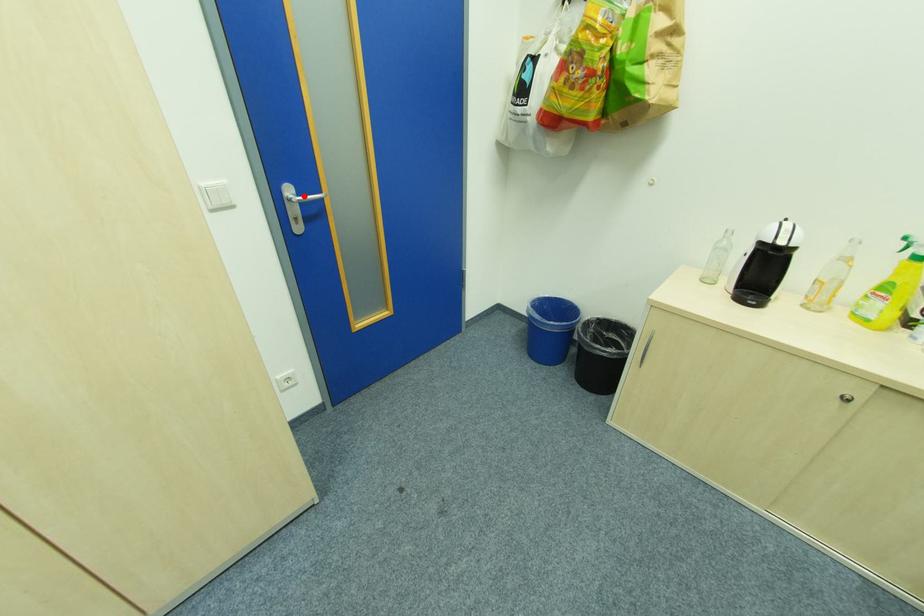
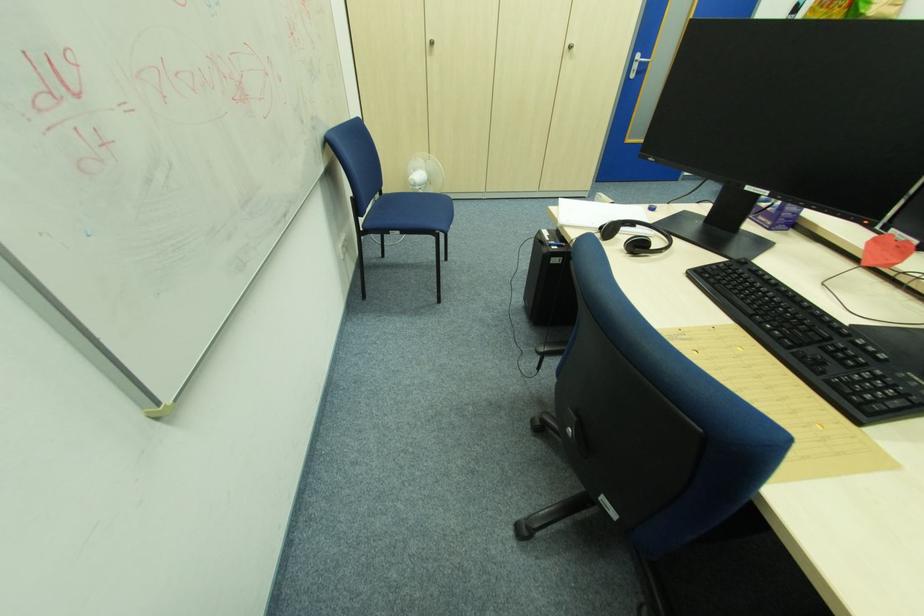
Locate, in the second image, the point that corresponds to the highlighted location in the first image.

(647, 61)